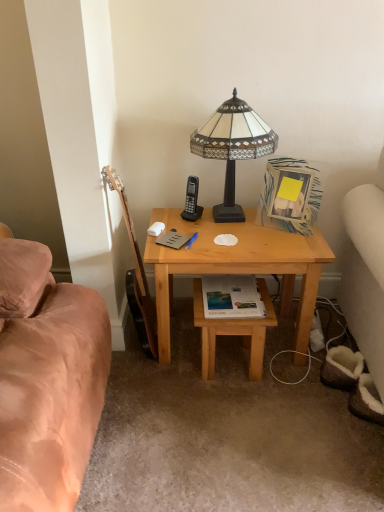
Identify the location of vacant space in front of light brown wooden stool at lower center. pyautogui.click(x=243, y=410).